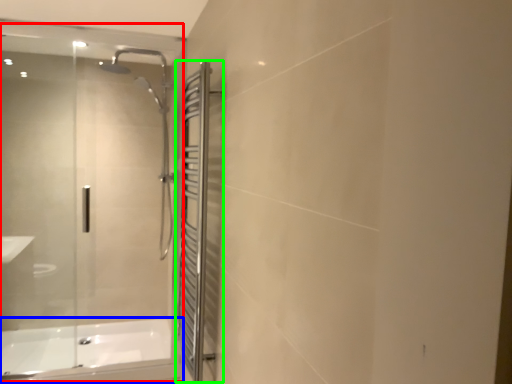
Question: Considering the real-world distances, which object is closest to glass door (highlighted by a red box)? bathtub (highlighted by a blue box) or screen door (highlighted by a green box).

Choices:
 (A) bathtub
 (B) screen door

Answer: (A)